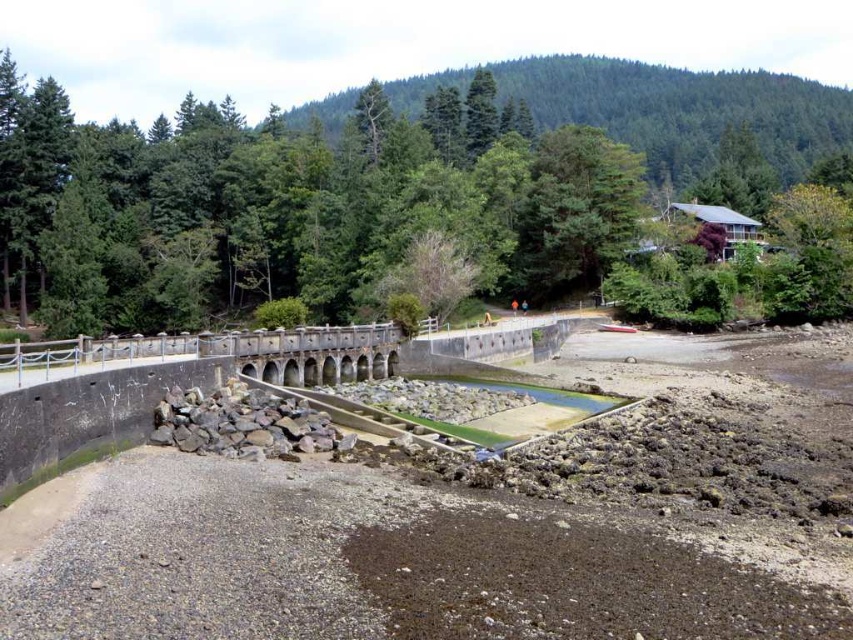
You are standing on the stone arch bridge at center and want to reach the green leafy tree at upper center. Which direction should you walk to get there?

The green leafy tree at upper center is to the right of the stone arch bridge at center, so you should walk to the right to reach it.

You are standing at the dam and want to place a small buoy between the two points, point [192,308] and point [244,332]. Which point is closer to you so that the buoy can be placed in front of it?

Point [192,308] is closer to you than point [244,332], so placing the buoy in front of point [192,308] would be closer to your current position.